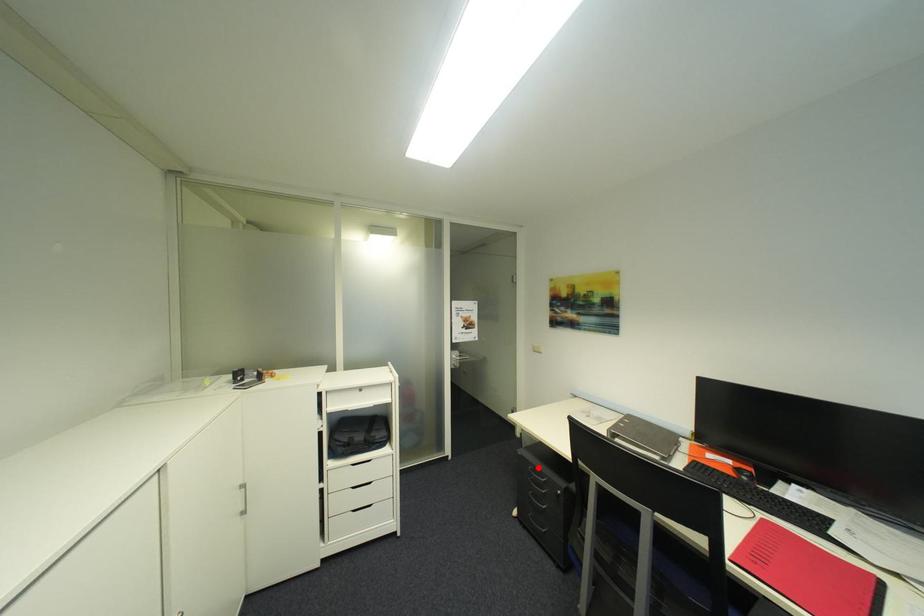
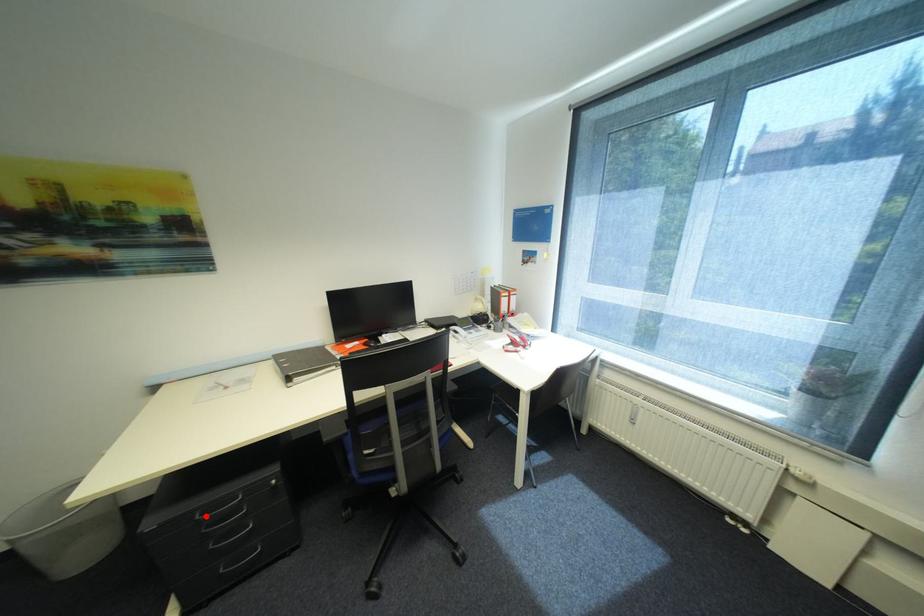
I am providing you with two images of the same scene from different viewpoints. A red point is marked on the first image and another point is marked on the second image. Are the points marked in image1 and image2 representing the same 3D position?

Yes